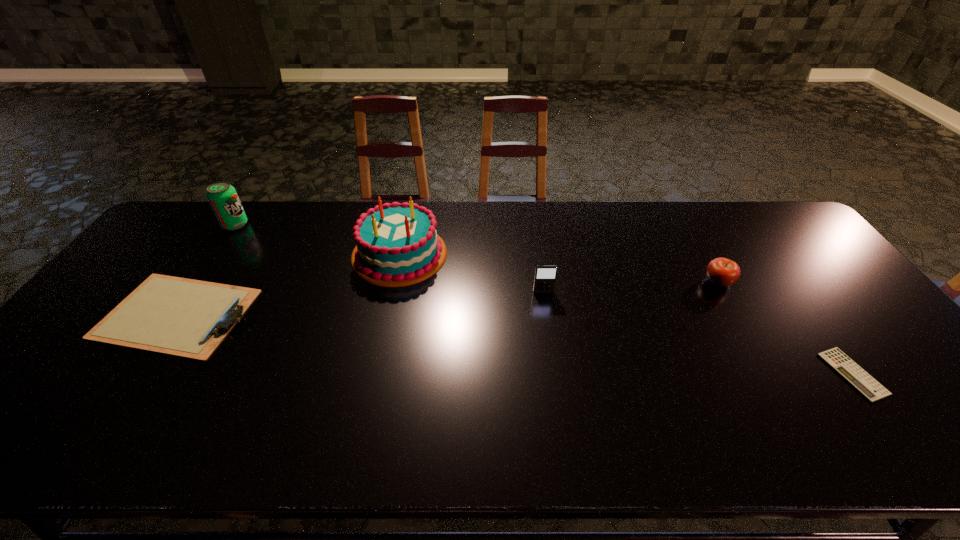
Locate an element on the screen. vacant space positioned 0.390m on the right of the third object from left to right is located at coordinates (573, 254).

Locate an element on the screen. The width and height of the screenshot is (960, 540). free space located 0.370m on the front-facing side of the fifth shortest object is located at coordinates (357, 225).

Find the location of a particular element. free point located 0.260m on the front-facing side of the fourth shortest object is located at coordinates (555, 370).

I want to click on free region located on the back of the apple, so click(x=689, y=231).

The height and width of the screenshot is (540, 960). I want to click on vacant space located 0.160m on the front of the clipboard, so click(x=106, y=421).

Where is `free spot located on the back of the rightmost object`? The height and width of the screenshot is (540, 960). free spot located on the back of the rightmost object is located at coordinates (814, 321).

Locate an element on the screen. birthday cake situated at the far edge is located at coordinates (397, 245).

Locate an element on the screen. The height and width of the screenshot is (540, 960). pop soda located in the far edge section of the desktop is located at coordinates (222, 196).

What are the coordinates of `object present at the left edge` in the screenshot? It's located at (188, 318).

Locate an element on the screen. object present at the right edge is located at coordinates 865,384.